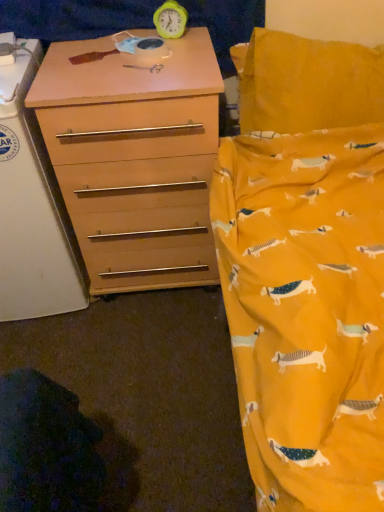
Find the location of a particular element. vacant space situated above matte wood chest of drawers at left (from a real-world perspective) is located at coordinates (115, 57).